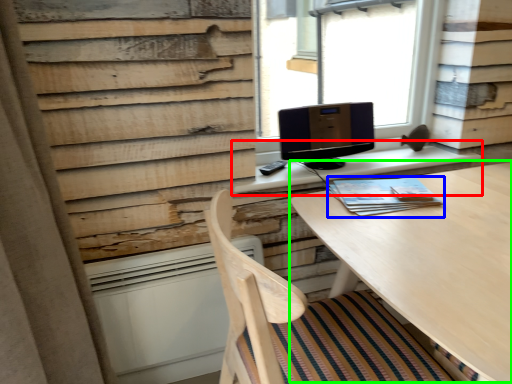
Question: Which object is positioned farthest from table (highlighted by a red box)? Select from book (highlighted by a blue box) and round table (highlighted by a green box).

Choices:
 (A) book
 (B) round table

Answer: (B)